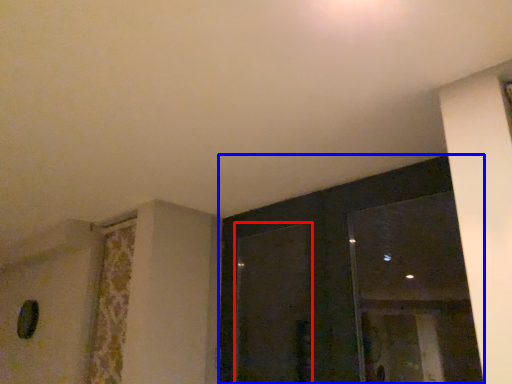
Question: Among these objects, which one is farthest to the camera, screen door (highlighted by a red box) or window (highlighted by a blue box)?

Choices:
 (A) screen door
 (B) window

Answer: (A)